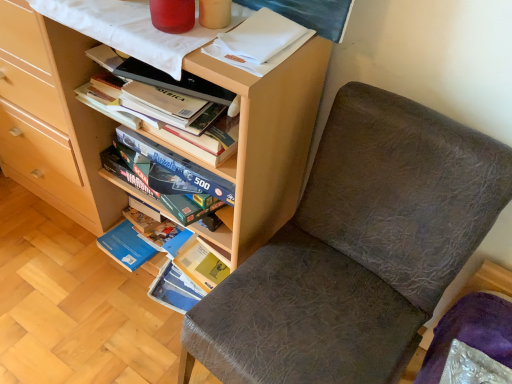
What do you see at coordinates (54, 119) in the screenshot? Image resolution: width=512 pixels, height=384 pixels. I see `matte wood bookcase at center` at bounding box center [54, 119].

The height and width of the screenshot is (384, 512). I want to click on matte wood bookcase at center, so click(x=54, y=119).

Describe the element at coordinates (357, 249) in the screenshot. The height and width of the screenshot is (384, 512). I see `brown leather chair at center` at that location.

Locate an element on the screen. brown leather chair at center is located at coordinates (357, 249).

Find the location of a particular element. This screenshot has width=512, height=384. matte wood bookcase at center is located at coordinates (54, 119).

In the image, is matte wood bookcase at center on the left side or the right side of brown leather chair at center?

Based on their positions, matte wood bookcase at center is located to the left of brown leather chair at center.

Considering the relative positions of matte wood bookcase at center and brown leather chair at center in the image provided, is matte wood bookcase at center behind brown leather chair at center?

That is True.

Which is behind, point (48, 34) or point (433, 133)?

Point (48, 34)

From the image's perspective, does matte wood bookcase at center appear higher than brown leather chair at center?

Yes, from the image's perspective, matte wood bookcase at center is on top of brown leather chair at center.

From a real-world perspective, which is physically below, matte wood bookcase at center or brown leather chair at center?

brown leather chair at center.

Is matte wood bookcase at center wider than brown leather chair at center?

Incorrect, the width of matte wood bookcase at center does not surpass that of brown leather chair at center.

Which of these two, matte wood bookcase at center or brown leather chair at center, stands taller?

matte wood bookcase at center.

Does matte wood bookcase at center have a smaller size compared to brown leather chair at center?

No, matte wood bookcase at center is not smaller than brown leather chair at center.

Based on the photo, is brown leather chair at center surrounded by matte wood bookcase at center?

That's incorrect, brown leather chair at center is not inside matte wood bookcase at center.

Looking at this image, can you see matte wood bookcase at center touching brown leather chair at center?

matte wood bookcase at center and brown leather chair at center are not in contact.

Is matte wood bookcase at center looking in the opposite direction of brown leather chair at center?

matte wood bookcase at center is not turned away from brown leather chair at center.

Can you tell me how much matte wood bookcase at center and brown leather chair at center differ in facing direction?

The facing directions of matte wood bookcase at center and brown leather chair at center are 3.21 degrees apart.

Identify the location of chair located in front of the matte wood bookcase at center. Image resolution: width=512 pixels, height=384 pixels. (357, 249).

Is brown leather chair at center to the right of matte wood bookcase at center from the viewer's perspective?

Yes, brown leather chair at center is to the right of matte wood bookcase at center.

Considering the relative positions of brown leather chair at center and matte wood bookcase at center in the image provided, is brown leather chair at center behind matte wood bookcase at center?

No, the depth of brown leather chair at center is less than that of matte wood bookcase at center.

Is point (310, 185) positioned after point (63, 57)?

No, it is in front of (63, 57).

From the image's perspective, is brown leather chair at center beneath matte wood bookcase at center?

Correct, brown leather chair at center appears lower than matte wood bookcase at center in the image.

In the scene shown: From a real-world perspective, is brown leather chair at center on matte wood bookcase at center?

Incorrect, from a real-world perspective, brown leather chair at center is lower than matte wood bookcase at center.

Considering the relative sizes of brown leather chair at center and matte wood bookcase at center in the image provided, is brown leather chair at center wider than matte wood bookcase at center?

Indeed, brown leather chair at center has a greater width compared to matte wood bookcase at center.

From their relative heights in the image, would you say brown leather chair at center is taller or shorter than matte wood bookcase at center?

Considering their sizes, brown leather chair at center has less height than matte wood bookcase at center.

Who is bigger, brown leather chair at center or matte wood bookcase at center?

matte wood bookcase at center is bigger.

Is brown leather chair at center inside the boundaries of matte wood bookcase at center, or outside?

brown leather chair at center is outside matte wood bookcase at center.

Is brown leather chair at center far away from matte wood bookcase at center?

They are positioned close to each other.

Consider the image. Does brown leather chair at center turn towards matte wood bookcase at center?

No, brown leather chair at center is not facing towards matte wood bookcase at center.

Can you tell me how much brown leather chair at center and matte wood bookcase at center differ in facing direction?

The facing directions of brown leather chair at center and matte wood bookcase at center are 3.21 degrees apart.

How much distance is there between brown leather chair at center and matte wood bookcase at center?

brown leather chair at center and matte wood bookcase at center are 29.63 inches apart from each other.

Identify the location of bookcase on the left side of brown leather chair at center. The image size is (512, 384). click(54, 119).

Identify the location of chair below the matte wood bookcase at center (from the image's perspective). (357, 249).

Where is `bookcase behind the brown leather chair at center`? Image resolution: width=512 pixels, height=384 pixels. bookcase behind the brown leather chair at center is located at coordinates (54, 119).